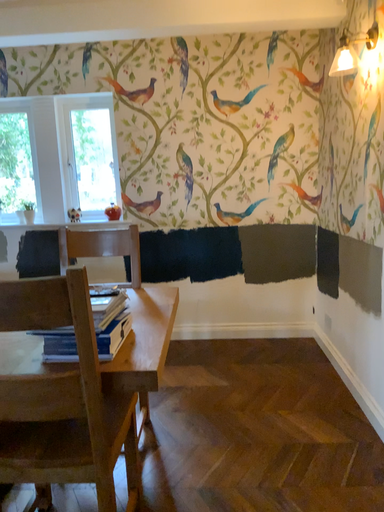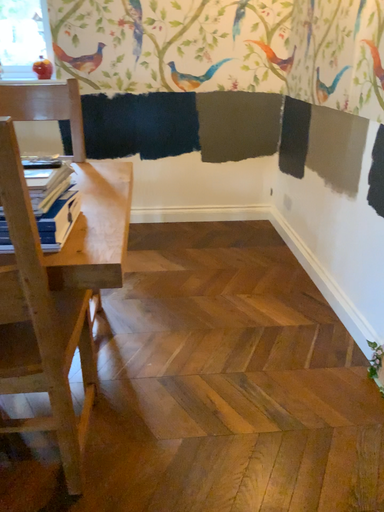
Question: How did the camera likely rotate when shooting the video?

Choices:
 (A) rotated upward
 (B) rotated downward

Answer: (B)